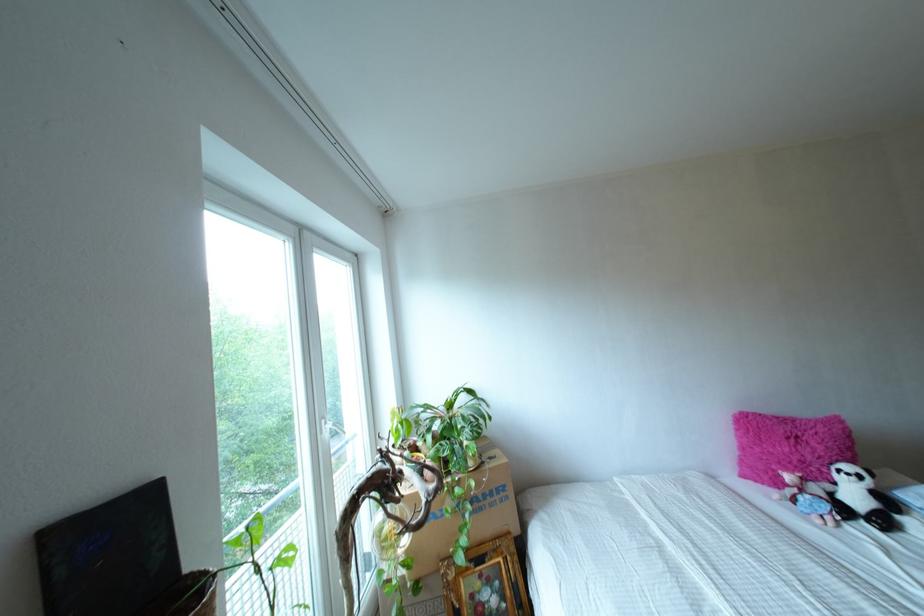
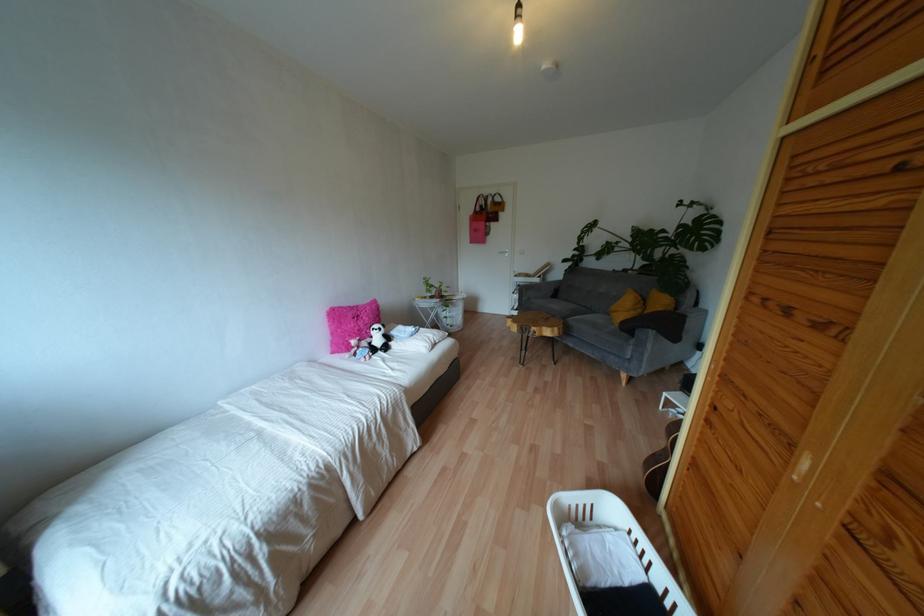
Question: The camera is either moving clockwise (left) or counter-clockwise (right) around the object. The first image is from the beginning of the video and the second image is from the end. Is the camera moving left or right when shooting the video?

Choices:
 (A) Left
 (B) Right

Answer: (A)